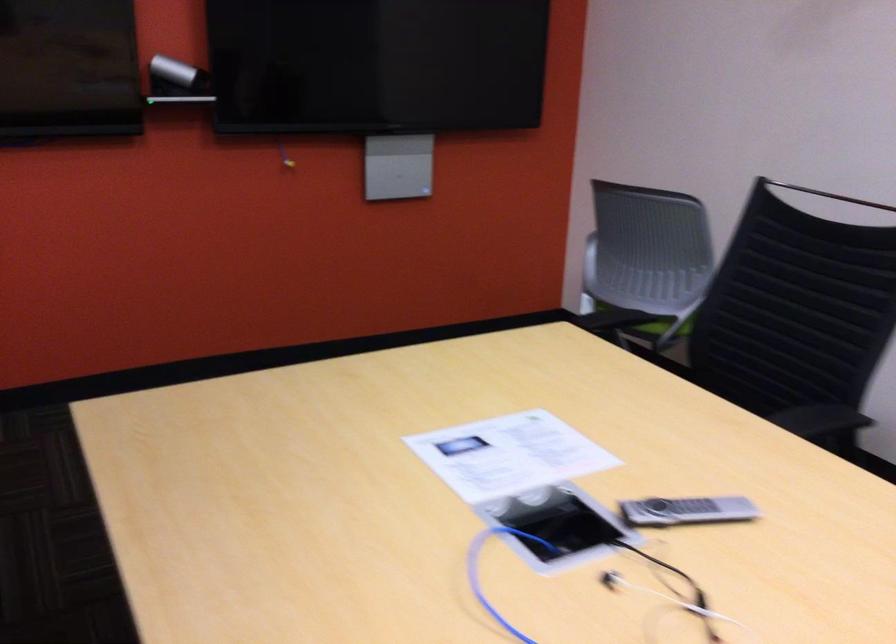
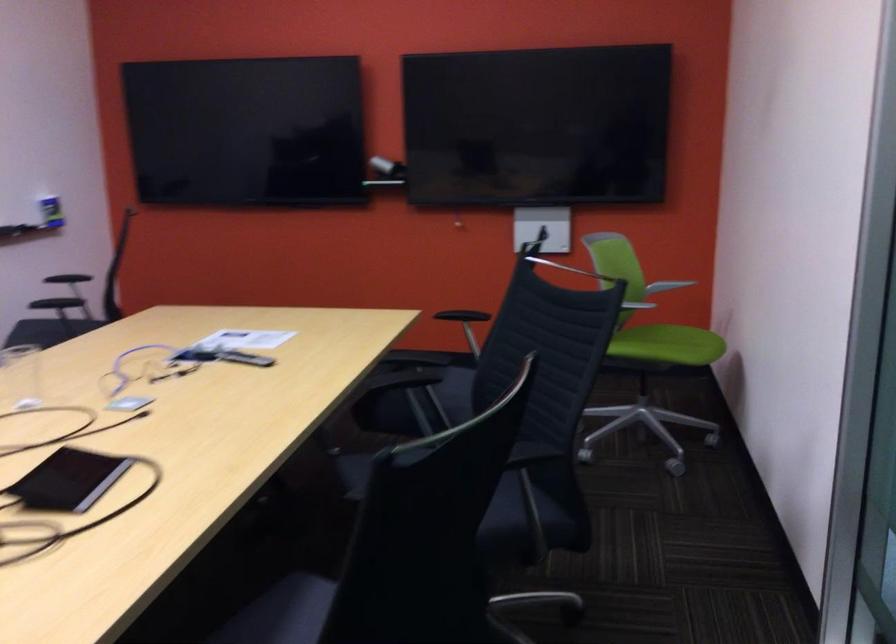
Where in the second image is the point corresponding to pixel 650 509 from the first image?

(244, 357)